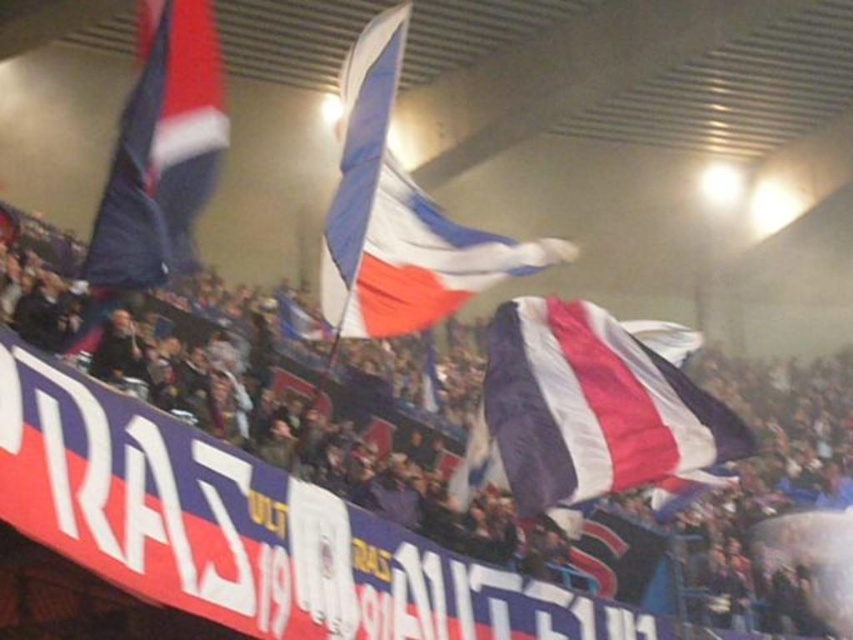
Question: Based on their relative distances, which object is farther from the textured fabric flags at center?

Choices:
 (A) matte fabric flag at center
 (B) white fabric flag at center
 (C) red and white striped flag at upper left

Answer: (C)

Question: Does white fabric flag at center have a smaller size compared to red and white striped flag at upper left?

Choices:
 (A) yes
 (B) no

Answer: (A)

Question: Can you confirm if white fabric flag at center is positioned to the right of red and white striped flag at upper left?

Choices:
 (A) yes
 (B) no

Answer: (A)

Question: Estimate the real-world distances between objects in this image. Which object is closer to the textured fabric flags at center?

Choices:
 (A) matte fabric flag at center
 (B) white fabric flag at center
 (C) red and white striped flag at upper left

Answer: (A)

Question: Estimate the real-world distances between objects in this image. Which object is farther from the matte fabric flag at center?

Choices:
 (A) white fabric flag at center
 (B) red and white striped flag at upper left

Answer: (B)

Question: From the image, what is the correct spatial relationship of textured fabric flags at center in relation to red and white striped flag at upper left?

Choices:
 (A) above
 (B) below

Answer: (B)